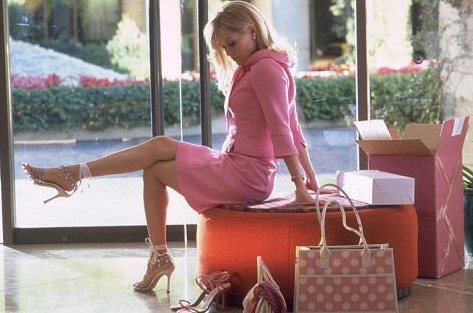
Locate an element on the screen. glass is located at coordinates (31, 15), (86, 71), (112, 201), (317, 34), (328, 145), (394, 80), (432, 20).